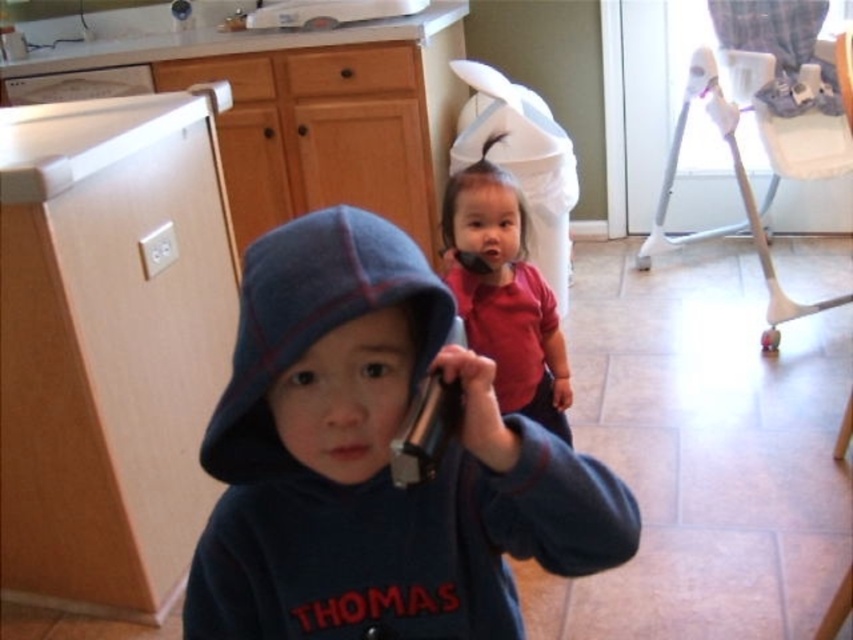
Question: Does dark blue fleece hoodie at center have a smaller size compared to red matte shirt at center?

Choices:
 (A) no
 (B) yes

Answer: (A)

Question: Is dark blue fleece hoodie at center positioned at the back of red matte shirt at center?

Choices:
 (A) no
 (B) yes

Answer: (A)

Question: Which object appears farthest from the camera in this image?

Choices:
 (A) dark blue fleece hoodie at center
 (B) red matte shirt at center

Answer: (B)

Question: Which point is farther to the camera?

Choices:
 (A) red matte shirt at center
 (B) dark blue fleece hoodie at center

Answer: (A)

Question: Can you confirm if dark blue fleece hoodie at center is wider than red matte shirt at center?

Choices:
 (A) yes
 (B) no

Answer: (A)